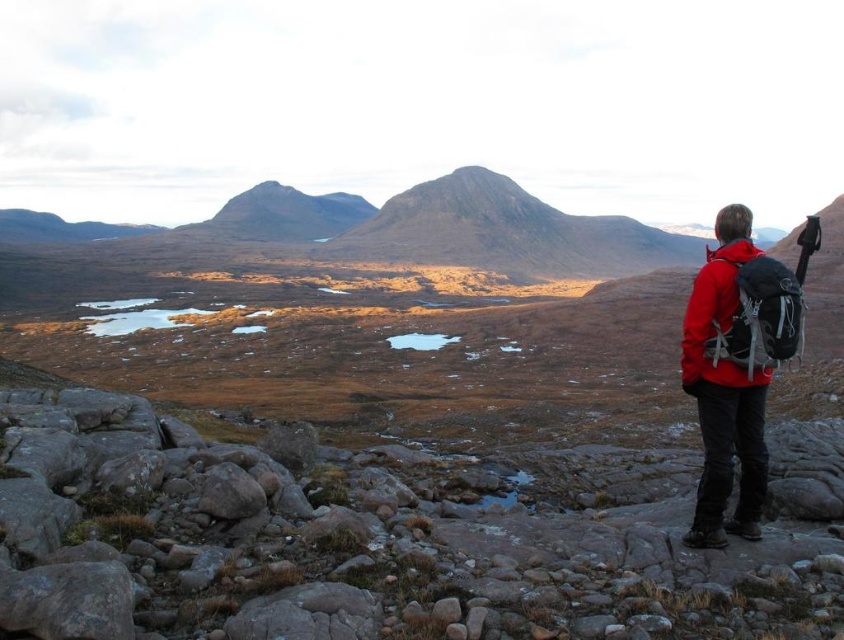
You are an explorer in the mountains and see two jackets, the red matte jacket at right and the matte red jacket at right. Which one should you grab if you need the bigger one?

The red matte jacket at right is larger in size than the matte red jacket at right, so you should grab the red matte jacket at right.

Consider the image. You are a hiker standing at the base of the mountains and see two points marked in the landscape. Which point is closer to you, point (701, 275) or point (783, 307)?

Point (701, 275) is closer to you because it is further to the viewer than point (783, 307).